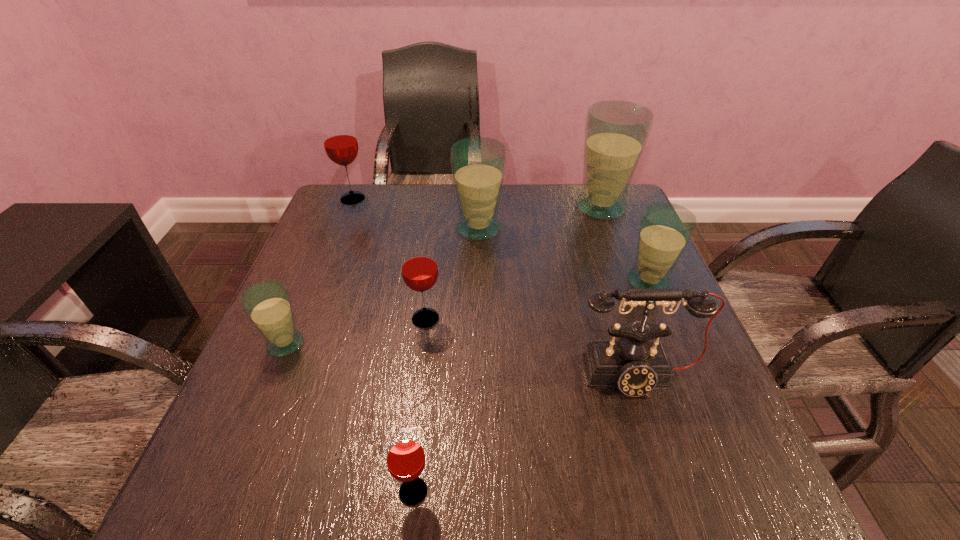
Locate an element on the screen. The height and width of the screenshot is (540, 960). the leftmost blue glass is located at coordinates (267, 304).

At what (x,y) coordinates should I click in order to perform the action: click on the smallest blue glass. Please return your answer as a coordinate pair (x, y). This screenshot has height=540, width=960. Looking at the image, I should click on (267, 304).

Identify the location of the nearest glass. (405, 457).

At what (x,y) coordinates should I click in order to perform the action: click on the nearest object. Please return your answer as a coordinate pair (x, y). Image resolution: width=960 pixels, height=540 pixels. Looking at the image, I should click on (405, 457).

Where is `free space located on the left of the tallest object`? Image resolution: width=960 pixels, height=540 pixels. free space located on the left of the tallest object is located at coordinates (491, 207).

The width and height of the screenshot is (960, 540). Find the location of `vacant space located 0.170m on the right of the leftmost red glass`. vacant space located 0.170m on the right of the leftmost red glass is located at coordinates (427, 199).

Find the location of `free point located 0.240m on the right of the third glass from right to left`. free point located 0.240m on the right of the third glass from right to left is located at coordinates (595, 228).

Locate an element on the screen. This screenshot has width=960, height=540. vacant space situated 0.150m on the dial of the black telephone is located at coordinates (670, 485).

Locate an element on the screen. free space located 0.340m on the right of the second smallest red glass is located at coordinates (606, 319).

At what (x,y) coordinates should I click in order to perform the action: click on vacant space situated 0.230m on the left of the third farthest blue glass. Please return your answer as a coordinate pair (x, y). Looking at the image, I should click on (524, 282).